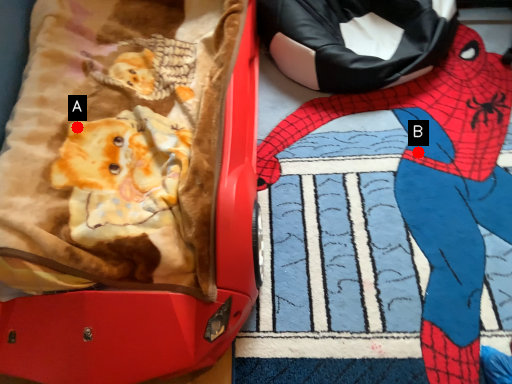
Question: Two points are circled on the image, labeled by A and B beside each circle. Which of the following is the farthest from the observer?

Choices:
 (A) A is further
 (B) B is further

Answer: (B)